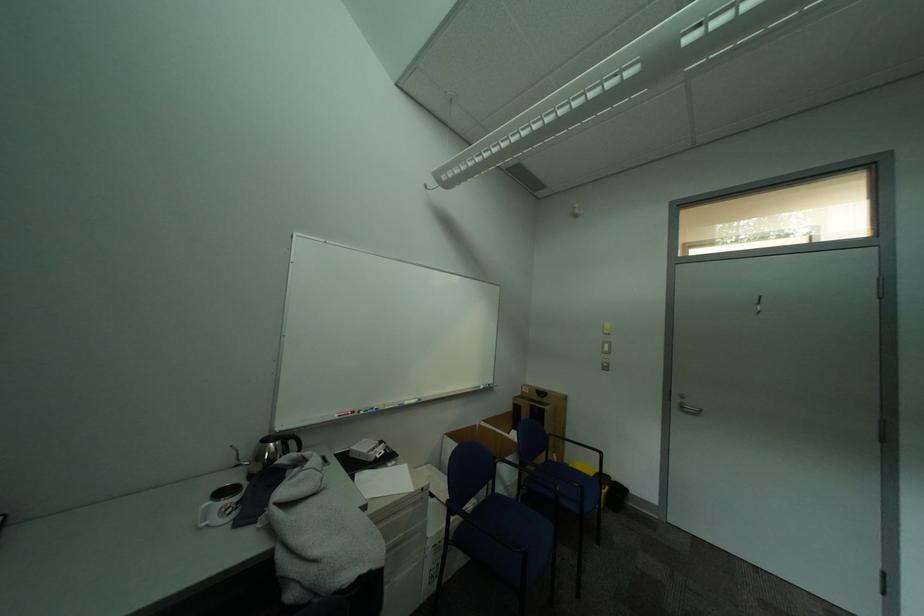
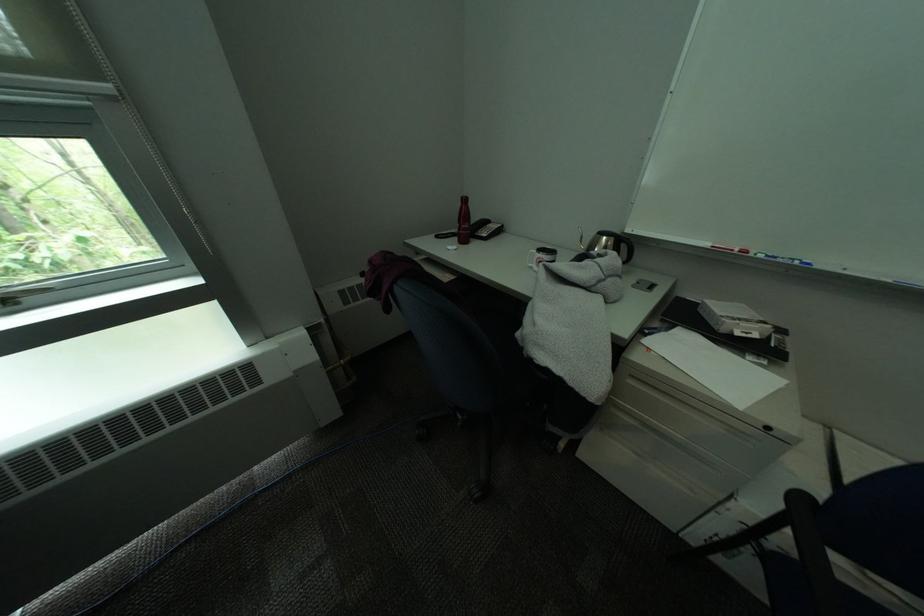
In the second image, find the point that corresponds to the point at 242,504 in the first image.

(553, 260)